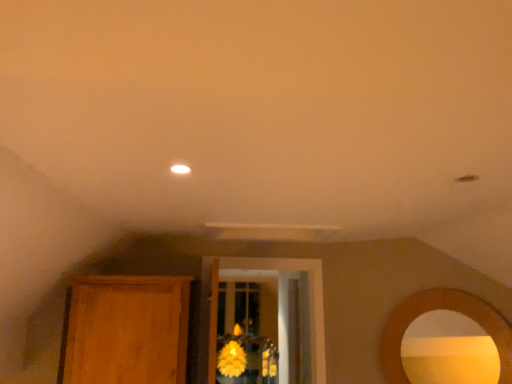
Image resolution: width=512 pixels, height=384 pixels. Identify the location of wooden armoire at left. (126, 330).

What do you see at coordinates (231, 359) in the screenshot? The height and width of the screenshot is (384, 512). I see `yellow matte flower at center` at bounding box center [231, 359].

What do you see at coordinates (449, 350) in the screenshot?
I see `matte gold mirror at right` at bounding box center [449, 350].

The image size is (512, 384). What are the coordinates of `wooden armoire at left` in the screenshot? It's located at (126, 330).

How many degrees apart are the facing directions of wooden armoire at left and matte gold mirror at right?

They differ by 42.2 degrees in their facing directions.

In the scene shown: Is wooden armoire at left with matte gold mirror at right?

No, wooden armoire at left is not in contact with matte gold mirror at right.

Which of these two, wooden armoire at left or matte gold mirror at right, is bigger?

With larger size is wooden armoire at left.

From the image's perspective, relative to matte gold mirror at right, is wooden armoire at left above or below?

Clearly, from the image's perspective, wooden armoire at left is above matte gold mirror at right.

How distant is matte gold mirror at right from wooden armoire at left?

matte gold mirror at right is 5.60 feet away from wooden armoire at left.

Which point is more forward, (478,341) or (73,300)?

The point (73,300) is closer to the camera.

Identify the location of armoire located behind the matte gold mirror at right. This screenshot has height=384, width=512. (126, 330).

Does matte gold mirror at right turn towards wooden armoire at left?

No, matte gold mirror at right does not turn towards wooden armoire at left.

Which object is closer to the camera taking this photo, yellow matte flower at center or matte gold mirror at right?

matte gold mirror at right is in front.

From the image's perspective, which is below, yellow matte flower at center or matte gold mirror at right?

yellow matte flower at center.

Between yellow matte flower at center and matte gold mirror at right, which one has less height?

matte gold mirror at right is shorter.

From the picture: Considering the sizes of objects yellow matte flower at center and wooden armoire at left in the image provided, who is thinner, yellow matte flower at center or wooden armoire at left?

With smaller width is yellow matte flower at center.

Is yellow matte flower at center completely or partially outside of wooden armoire at left?

Indeed, yellow matte flower at center is completely outside wooden armoire at left.

Identify the location of flower behind the wooden armoire at left. The height and width of the screenshot is (384, 512). (231, 359).

From a real-world perspective, is yellow matte flower at center positioned above or below wooden armoire at left?

Clearly, from a real-world perspective, yellow matte flower at center is below wooden armoire at left.

Is matte gold mirror at right bigger or smaller than yellow matte flower at center?

In the image, matte gold mirror at right appears to be smaller than yellow matte flower at center.

Considering the sizes of matte gold mirror at right and yellow matte flower at center in the image, is matte gold mirror at right wider or thinner than yellow matte flower at center?

In the image, matte gold mirror at right appears to be more narrow than yellow matte flower at center.

From the image's perspective, would you say matte gold mirror at right is shown under yellow matte flower at center?

No, from the image's perspective, matte gold mirror at right is not below yellow matte flower at center.

Are matte gold mirror at right and yellow matte flower at center far apart?

Absolutely, matte gold mirror at right is distant from yellow matte flower at center.

This screenshot has width=512, height=384. In order to click on flower below the wooden armoire at left (from the image's perspective) in this screenshot , I will do `click(231, 359)`.

Is wooden armoire at left with yellow matte flower at center?

No, wooden armoire at left is not with yellow matte flower at center.

From a real-world perspective, who is located higher, wooden armoire at left or yellow matte flower at center?

From a 3D spatial view, wooden armoire at left is above.

Does wooden armoire at left appear on the left side of yellow matte flower at center?

Correct, you'll find wooden armoire at left to the left of yellow matte flower at center.

Identify the location of armoire above the matte gold mirror at right (from the image's perspective). This screenshot has height=384, width=512. (126, 330).

Locate an element on the screen. mirror directly beneath the wooden armoire at left (from a real-world perspective) is located at coordinates (449, 350).

Estimate the real-world distances between objects in this image. Which object is further from matte gold mirror at right, yellow matte flower at center or wooden armoire at left?

yellow matte flower at center is further to matte gold mirror at right.

Considering their positions, is matte gold mirror at right positioned further to yellow matte flower at center than wooden armoire at left?

matte gold mirror at right lies further to yellow matte flower at center than the other object.

From the image, which object appears to be farther from wooden armoire at left, yellow matte flower at center or matte gold mirror at right?

Based on the image, yellow matte flower at center appears to be further to wooden armoire at left.

Estimate the real-world distances between objects in this image. Which object is further from matte gold mirror at right, wooden armoire at left or yellow matte flower at center?

Based on the image, yellow matte flower at center appears to be further to matte gold mirror at right.

Estimate the real-world distances between objects in this image. Which object is closer to yellow matte flower at center, wooden armoire at left or matte gold mirror at right?

wooden armoire at left lies closer to yellow matte flower at center than the other object.

Based on their spatial positions, is matte gold mirror at right or yellow matte flower at center closer to wooden armoire at left?

matte gold mirror at right is positioned closer to the anchor wooden armoire at left.

Identify the location of armoire located between matte gold mirror at right and yellow matte flower at center in the depth direction. Image resolution: width=512 pixels, height=384 pixels. (126, 330).